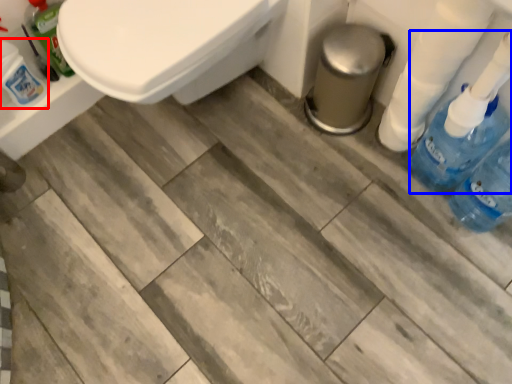
Question: Which point is closer to the camera, cleaning product (highlighted by a red box) or cleaning product (highlighted by a blue box)?

Choices:
 (A) cleaning product
 (B) cleaning product

Answer: (B)